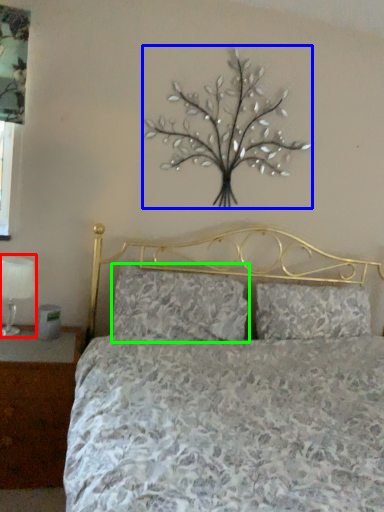
Question: Which object is the closest to the table lamp (highlighted by a red box)? Choose among these: flower (highlighted by a blue box) or pillow (highlighted by a green box).

Choices:
 (A) flower
 (B) pillow

Answer: (B)